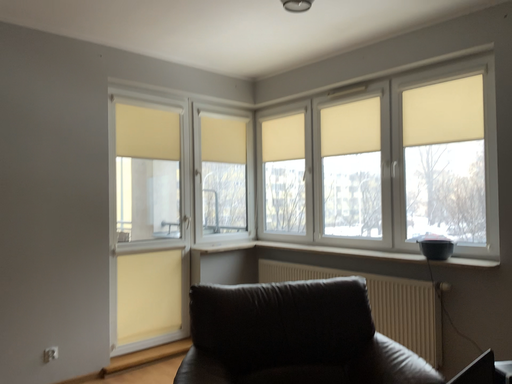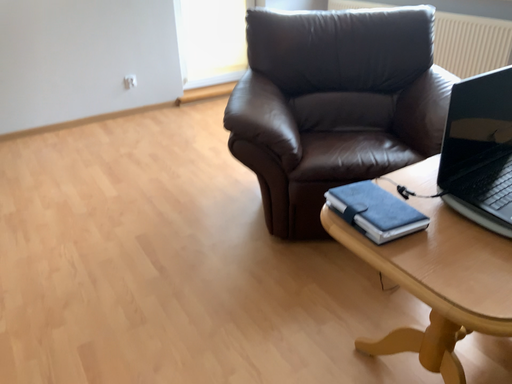
Question: Which way did the camera rotate in the video?

Choices:
 (A) rotated left
 (B) rotated right

Answer: (A)